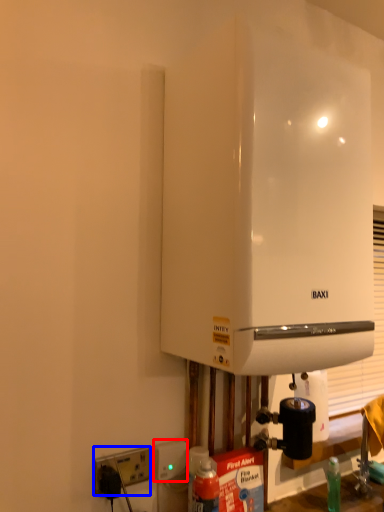
Question: Which object appears closest to the camera in this image, electric outlet (highlighted by a red box) or electric outlet (highlighted by a blue box)?

Choices:
 (A) electric outlet
 (B) electric outlet

Answer: (B)